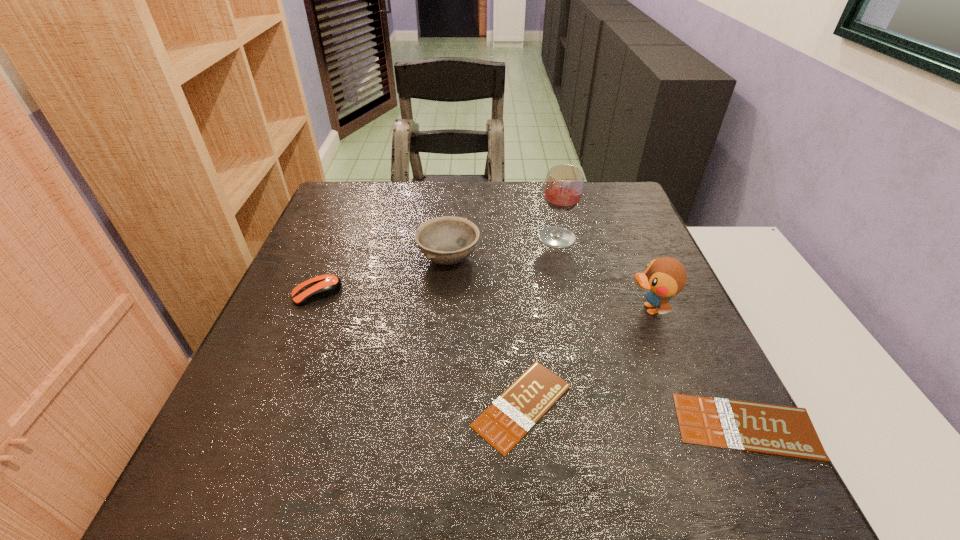
The chocolate bars are evenly distributed in the image. To maintain this, where would you place another chocolate bar on the left? Please point to a free space. Please provide its 2D coordinates. Your answer should be formatted as a tuple, i.e. [(x, y)], where the tuple contains the x and y coordinates of a point satisfying the conditions above.

[(315, 386)]